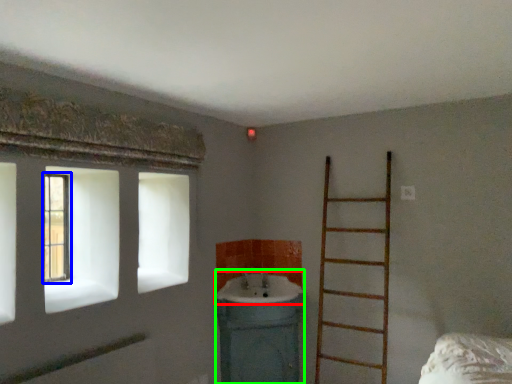
Question: Which object is positioned farthest from sink (highlighted by a red box)? Select from window (highlighted by a blue box) and sink (highlighted by a green box).

Choices:
 (A) window
 (B) sink

Answer: (A)